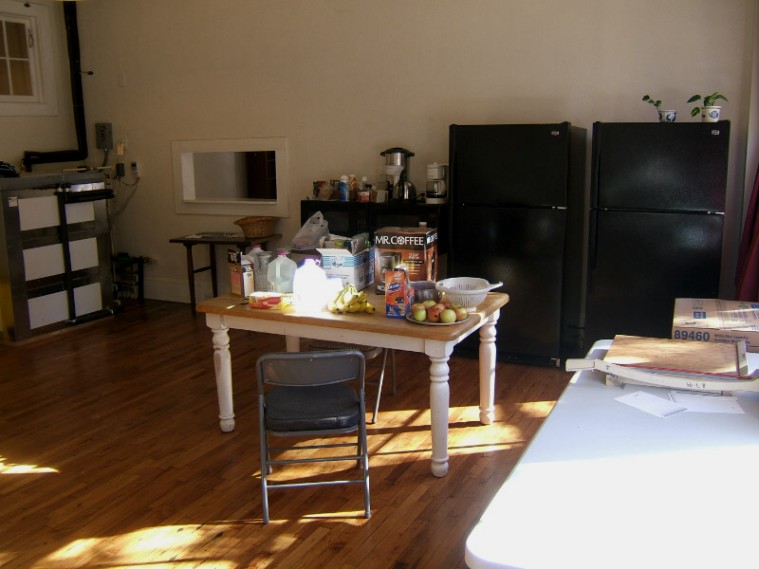
Identify the location of lamp. (290, 295).